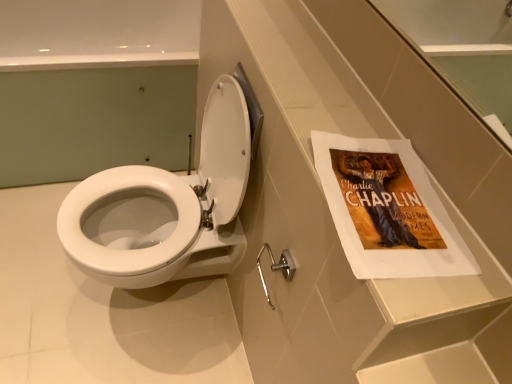
Find the location of a particular element. vacant space in front of white glossy toilet at center is located at coordinates (119, 358).